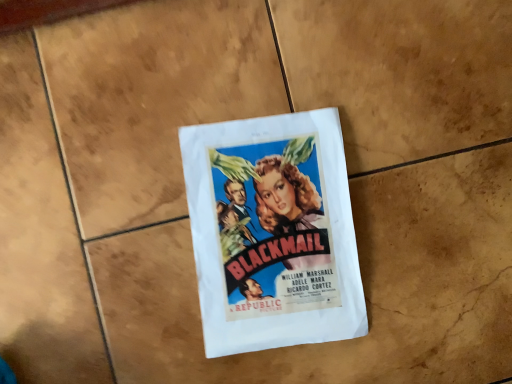
Locate an element on the screen. The height and width of the screenshot is (384, 512). blank space situated above matte paper poster at center (from a real-world perspective) is located at coordinates (279, 238).